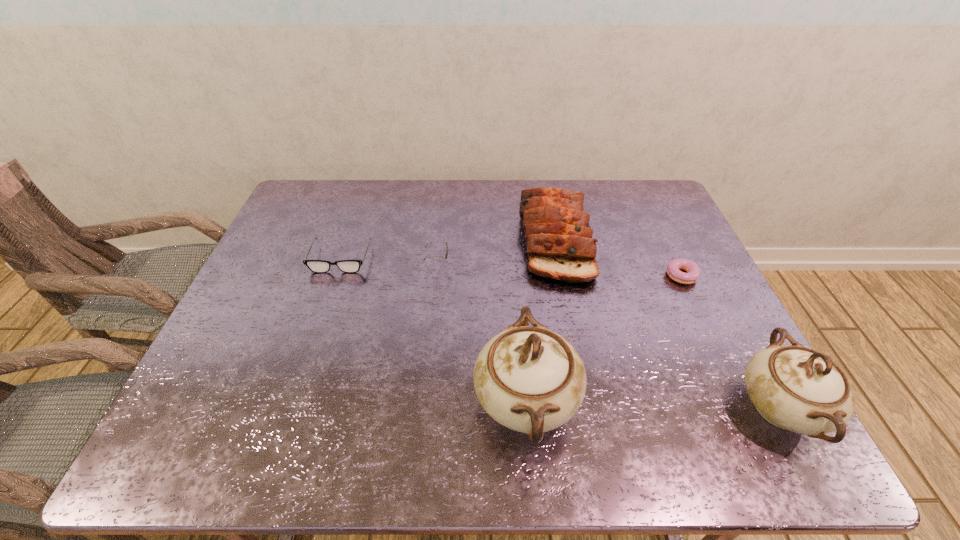
At what (x,y) coordinates should I click in order to perform the action: click on the tallest object. Please return your answer as a coordinate pair (x, y). The width and height of the screenshot is (960, 540). Looking at the image, I should click on (529, 379).

Locate an element on the screen. This screenshot has height=540, width=960. the left chinaware is located at coordinates (529, 379).

The width and height of the screenshot is (960, 540). Find the location of `the right chinaware`. the right chinaware is located at coordinates (795, 388).

You are a GUI agent. You are given a task and a screenshot of the screen. Output one action in this format:
    pyautogui.click(x=<x>, y=<y>)
    Task: Click on the shorter chinaware
    The image size is (960, 540).
    Given the screenshot: What is the action you would take?
    [795, 388]

The image size is (960, 540). Identify the location of spectacles. (317, 266).

Locate an element on the screen. This screenshot has height=540, width=960. the leftmost object is located at coordinates coord(317,266).

Identify the location of bread. This screenshot has width=960, height=540. (559, 239).

This screenshot has height=540, width=960. I want to click on doughnut, so click(674, 266).

This screenshot has width=960, height=540. Identify the location of the fourth tallest object. (446, 254).

What are the coordinates of `sunglasses` in the screenshot? It's located at pyautogui.click(x=446, y=254).